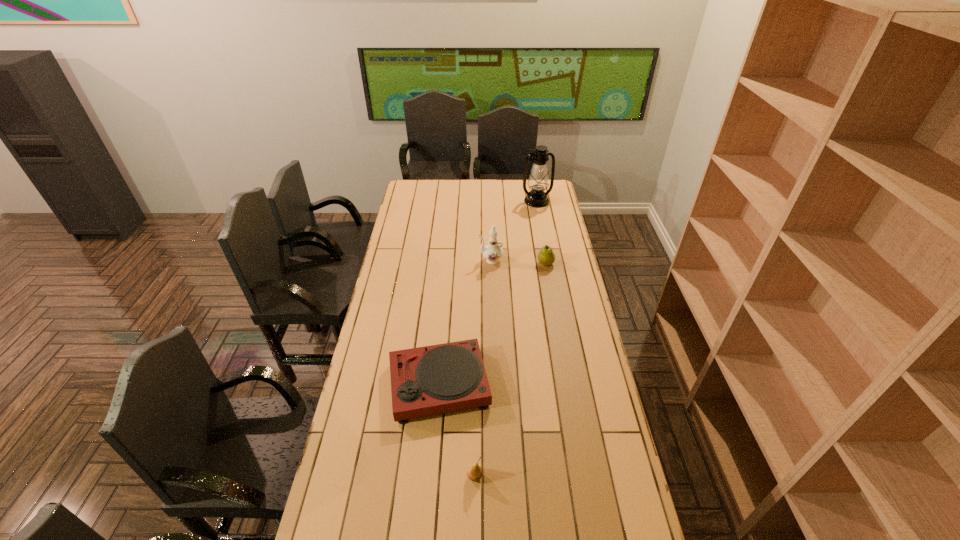
Where is `free space between the chinaware and the farther pear`? free space between the chinaware and the farther pear is located at coordinates (517, 262).

The width and height of the screenshot is (960, 540). Find the location of `free space that is in between the chinaware and the farthest object`. free space that is in between the chinaware and the farthest object is located at coordinates (514, 231).

Locate which object is the second closest to the left pear. Please provide its 2D coordinates. Your answer should be formatted as a tuple, i.e. [(x, y)], where the tuple contains the x and y coordinates of a point satisfying the conditions above.

[(493, 252)]

At what (x,y) coordinates should I click in order to perform the action: click on object that ranks as the fourth closest to the chinaware. Please return your answer as a coordinate pair (x, y). The width and height of the screenshot is (960, 540). Looking at the image, I should click on (474, 473).

Identify the location of vacant space that satisfies the following two spatial constraints: 1. at the spout of the fourth shortest object; 2. on the front side of the fourth farthest object. This screenshot has width=960, height=540. (493, 384).

Locate an element on the screen. The image size is (960, 540). vacant region that satisfies the following two spatial constraints: 1. at the spout of the fourth shortest object; 2. on the front side of the record player is located at coordinates (493, 384).

Find the location of a particular element. vacant point that satisfies the following two spatial constraints: 1. at the spout of the taller pear; 2. on the right side of the chinaware is located at coordinates (491, 264).

Locate an element on the screen. This screenshot has height=540, width=960. vacant position in the image that satisfies the following two spatial constraints: 1. on the back side of the third shortest object; 2. on the left side of the nearest object is located at coordinates (477, 264).

Where is `free space that satisfies the following two spatial constraints: 1. at the spout of the farther pear; 2. on the left side of the second tallest object`? The height and width of the screenshot is (540, 960). free space that satisfies the following two spatial constraints: 1. at the spout of the farther pear; 2. on the left side of the second tallest object is located at coordinates (491, 264).